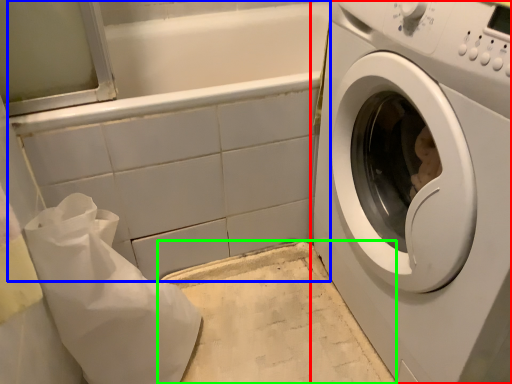
Question: Based on their relative distances, which object is farther from washing machine (highlighted by a red box)? Choose from bath (highlighted by a blue box) and counter top (highlighted by a green box).

Choices:
 (A) bath
 (B) counter top

Answer: (A)